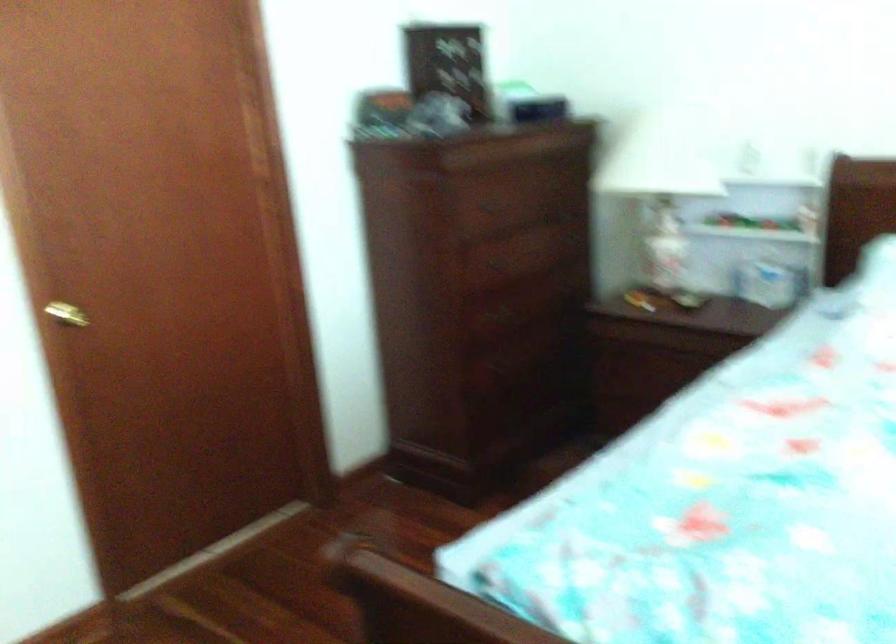
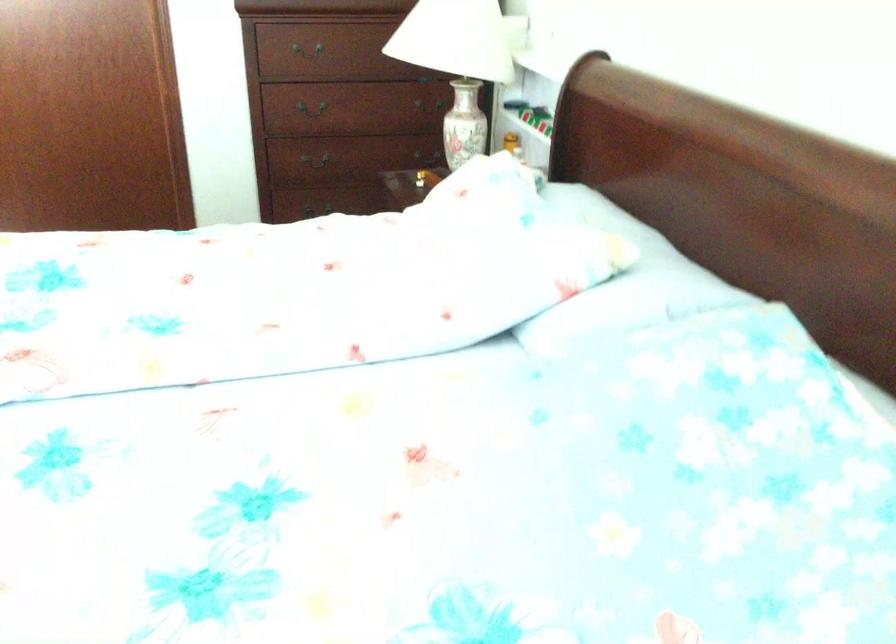
Find the pixel in the second image that matches point (622, 241) in the first image.

(463, 124)